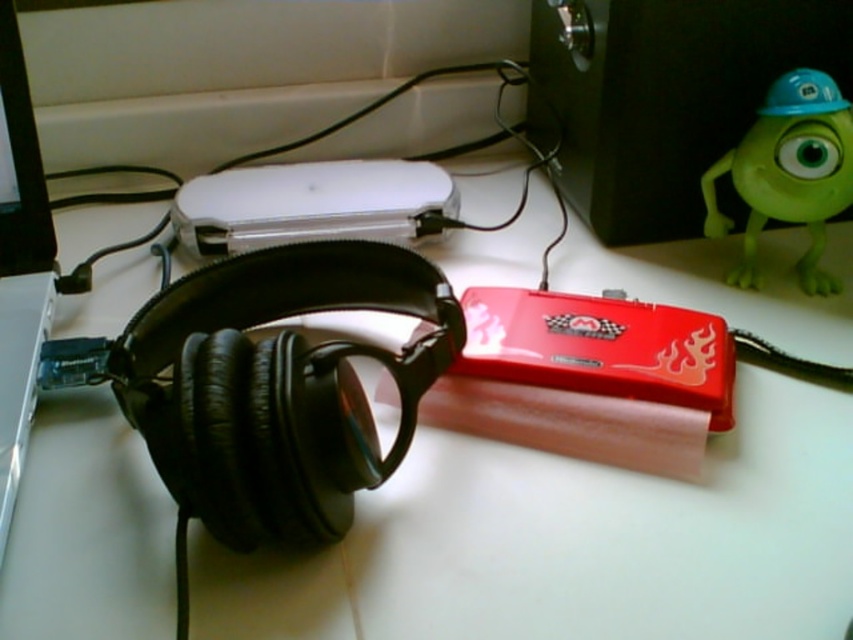
You are organizing items on a desk and want to stack the white glossy ipod at center and the green rubber toy at upper right. Which item should be placed at the bottom to ensure stability?

The green rubber toy at upper right should be placed at the bottom since it is taller than the white glossy ipod at center, providing a stable base.

You are organizing items on a desk and want to place the white glossy ipod at center and the green rubber toy at upper right. Which object requires more space due to its size?

The white glossy ipod at center requires more space because it is bigger than the green rubber toy at upper right.

Based on the scene description, where is the white glossy ipod at center located in terms of its 2D coordinates?

The white glossy ipod at center is located at the 2D coordinates of point (x=311, y=204).